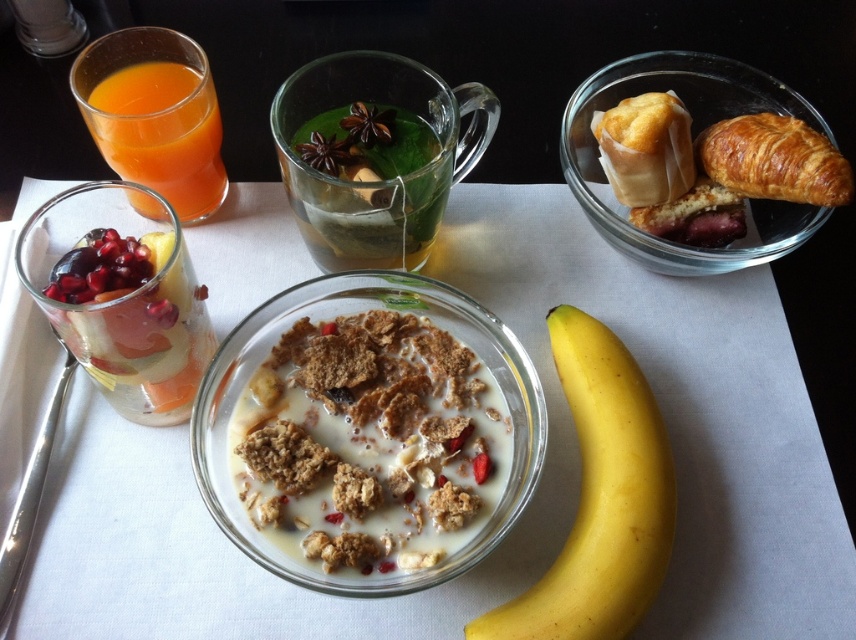
Question: Which object is closer to the camera taking this photo?

Choices:
 (A) golden flaky pastry at upper right
 (B) brown crunchy cereal at center

Answer: (B)

Question: Is brown crunchy cereal at center to the left of translucent glass at upper left from the viewer's perspective?

Choices:
 (A) yes
 (B) no

Answer: (B)

Question: Among these points, which one is farthest from the camera?

Choices:
 (A) (598, 586)
 (B) (841, 179)

Answer: (B)

Question: Among these objects, which one is nearest to the camera?

Choices:
 (A) golden brown flaky croissant at upper right
 (B) translucent glass at upper left

Answer: (A)

Question: Does green leafy tea at center appear on the right side of golden brown flaky croissant at upper right?

Choices:
 (A) no
 (B) yes

Answer: (A)

Question: Is translucent glass at upper left wider than golden flaky pastry at upper right?

Choices:
 (A) no
 (B) yes

Answer: (B)